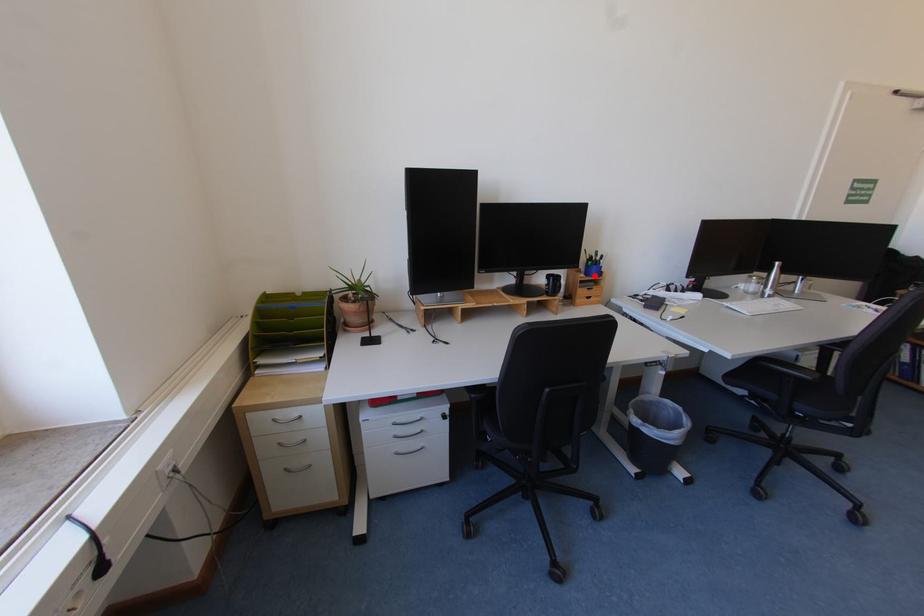
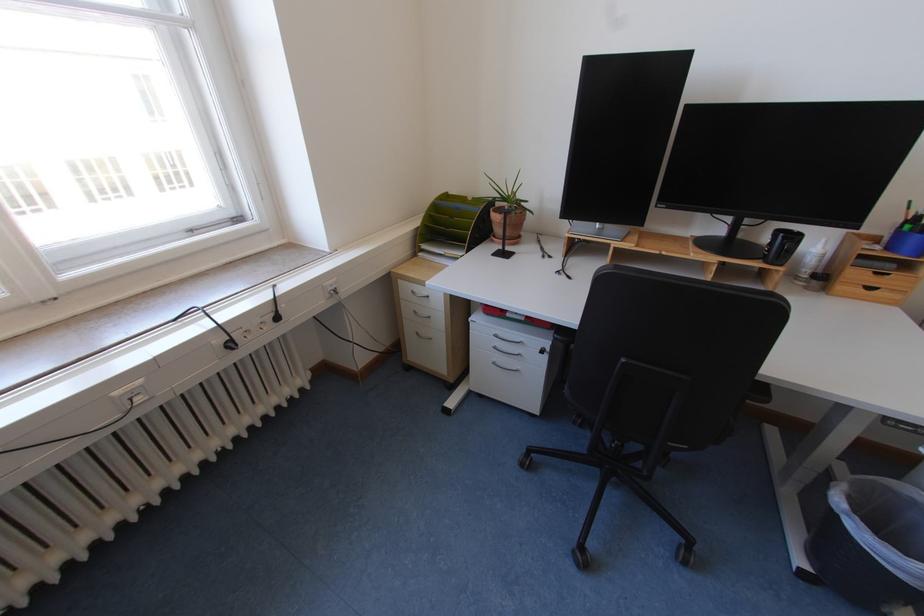
In the second image, find the point that corresponds to the highlighted location in the first image.

(896, 249)